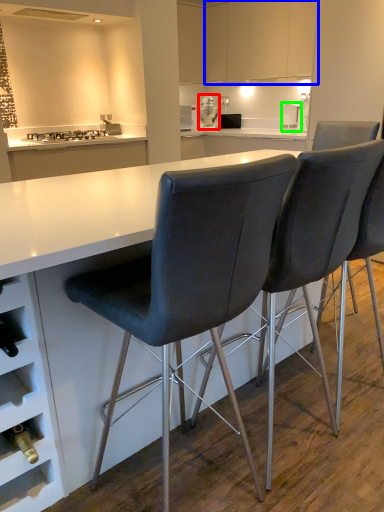
Question: Which is farther away from appliance (highlighted by a red box)? cabinetry (highlighted by a blue box) or kitchen appliance (highlighted by a green box)?

Choices:
 (A) cabinetry
 (B) kitchen appliance

Answer: (B)